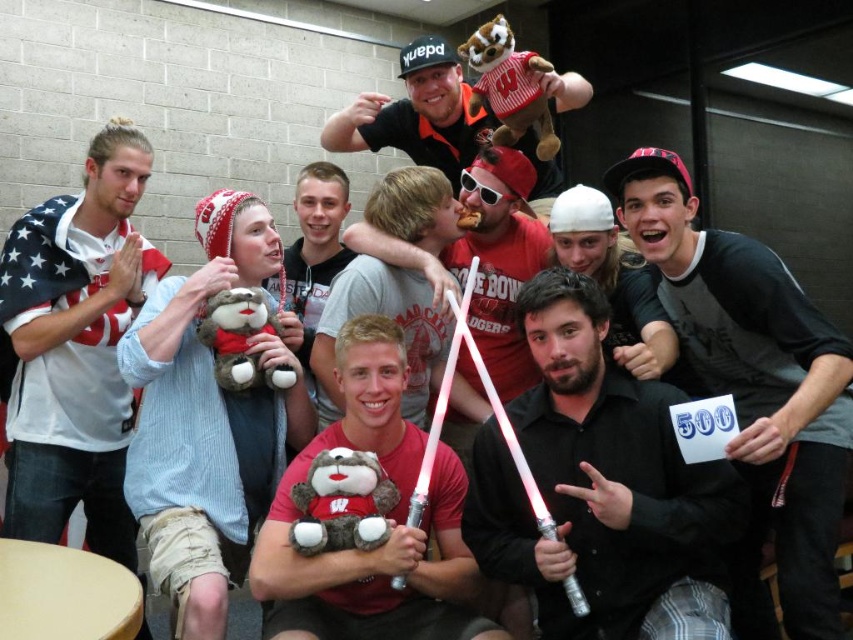
Question: Is black jersey at upper right bigger than white cotton shirt at left?

Choices:
 (A) yes
 (B) no

Answer: (A)

Question: Which of the following is the farthest from the observer?

Choices:
 (A) black matte shirt at center
 (B) black jersey at upper right

Answer: (A)

Question: Considering the real-world distances, which object is farthest from the black jersey at upper right?

Choices:
 (A) white cotton shirt at left
 (B) light gray shirt at center
 (C) black matte shirt at center

Answer: (A)

Question: Which object appears closest to the camera in this image?

Choices:
 (A) black matte cap at upper center
 (B) black jersey at upper right

Answer: (B)

Question: Observing the image, what is the correct spatial positioning of black matte shirt at center in reference to white cotton shirt at left?

Choices:
 (A) right
 (B) left

Answer: (A)

Question: Is black matte shirt at center above black matte cap at upper center?

Choices:
 (A) yes
 (B) no

Answer: (B)